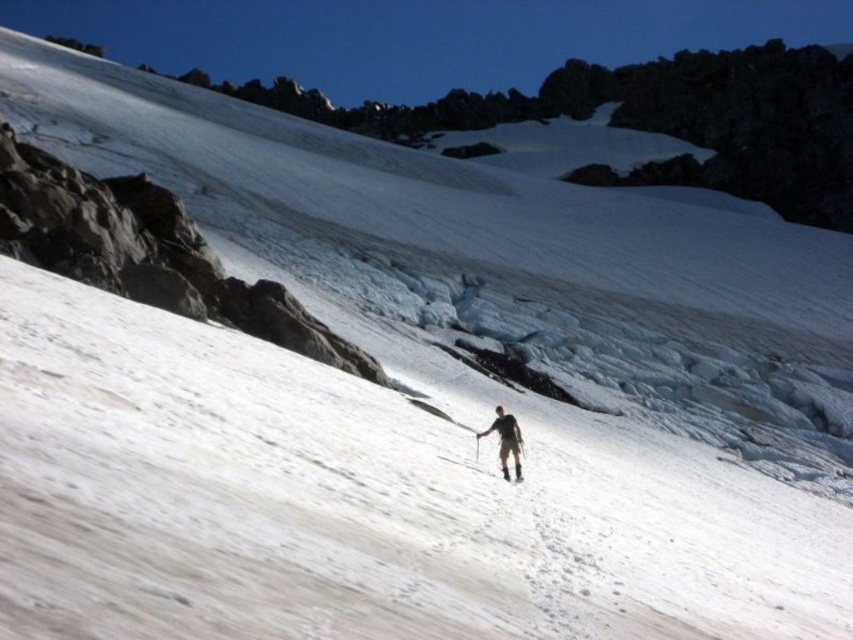
Question: Which point is closer to the camera?

Choices:
 (A) white matte ski at center
 (B) light brown fabric pants at center

Answer: (B)

Question: Considering the relative positions of light brown fabric pants at center and white matte ski at center in the image provided, where is light brown fabric pants at center located with respect to white matte ski at center?

Choices:
 (A) below
 (B) above

Answer: (B)

Question: Is light brown fabric pants at center wider than white matte ski at center?

Choices:
 (A) yes
 (B) no

Answer: (A)

Question: Does light brown fabric pants at center have a smaller size compared to white matte ski at center?

Choices:
 (A) no
 (B) yes

Answer: (A)

Question: Which of the following is the closest to the observer?

Choices:
 (A) (503, 417)
 (B) (509, 480)

Answer: (B)